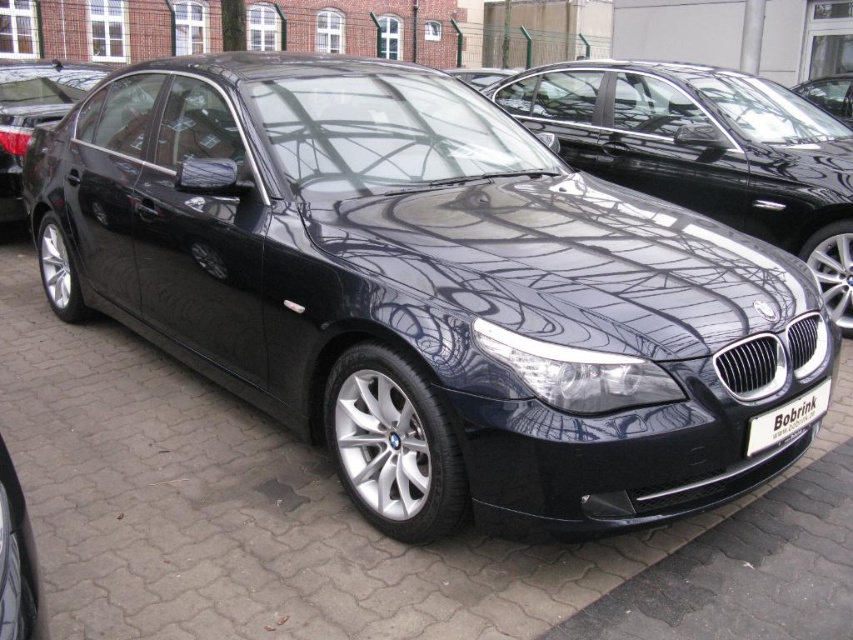
You are a photographer trying to capture the glossy black car at center and the glossy black car at lower left. Since both cars are glossy, you want to avoid reflections of other objects. Which car should you position closer to a reflective surface to minimize unwanted reflections?

The glossy black car at lower left is behind the glossy black car at center. Therefore, positioning the glossy black car at center closer to a reflective surface would minimize unwanted reflections because it is in front and closer to the camera, making its reflections more prominent and easier to control compared to the one behind.

You are a photographer standing at the camera position. You want to take a photo of the glossy black car at center. If your camera has a focal length of 50mm and you want to maintain a subject distance of 4.66 meters, what is the approximate angle of view required to capture the entire car in the frame?

The glossy black car at center is 4.66 meters away from the camera. Using the formula for angle of view, which is 2 arctan, the angle of view required would depend on the sensor size and focal length. However, with a 50mm lens and standard sensor size, the angle of view is typically around 46 degrees, which should allow capturing the car at this distance.